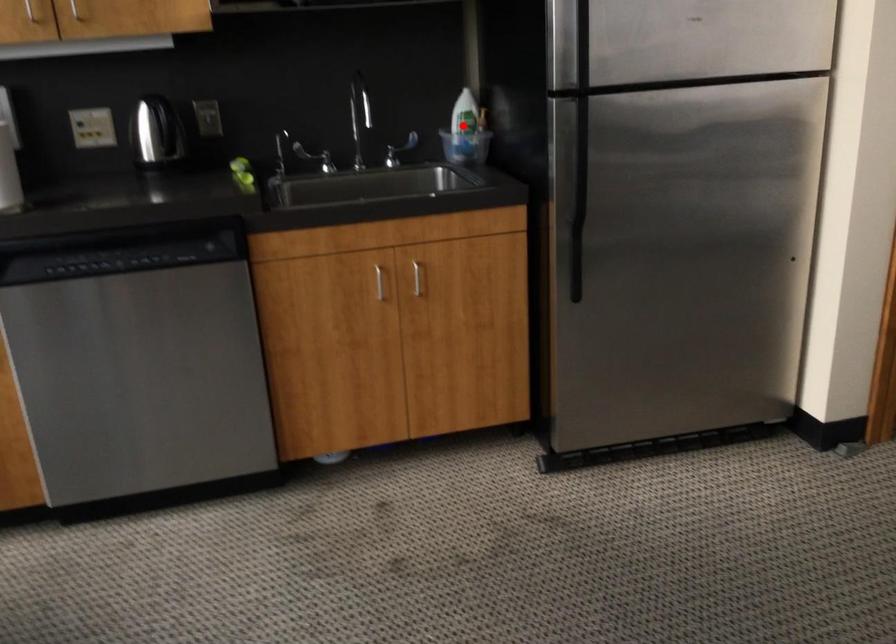
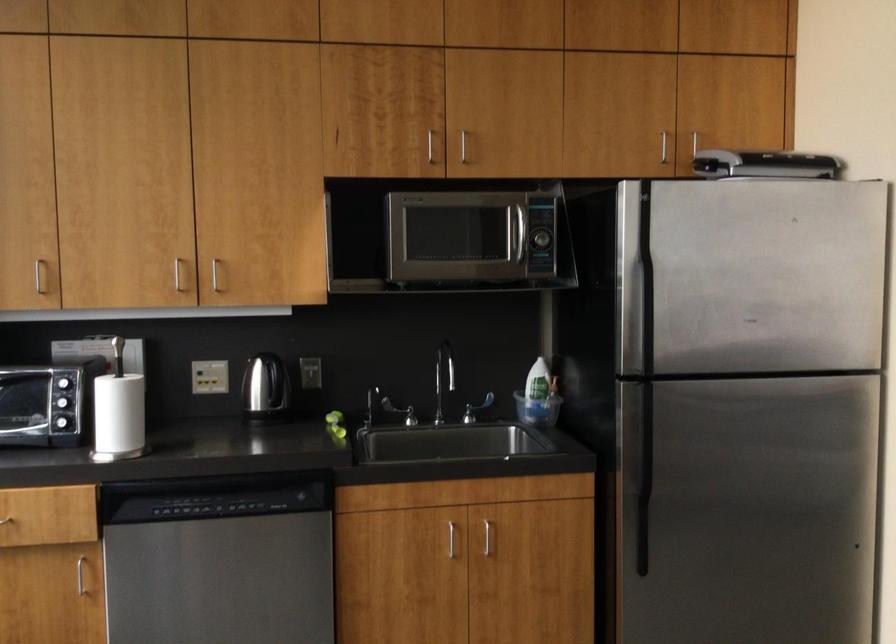
Locate, in the second image, the point that corresponds to the highlighted location in the first image.

(539, 391)